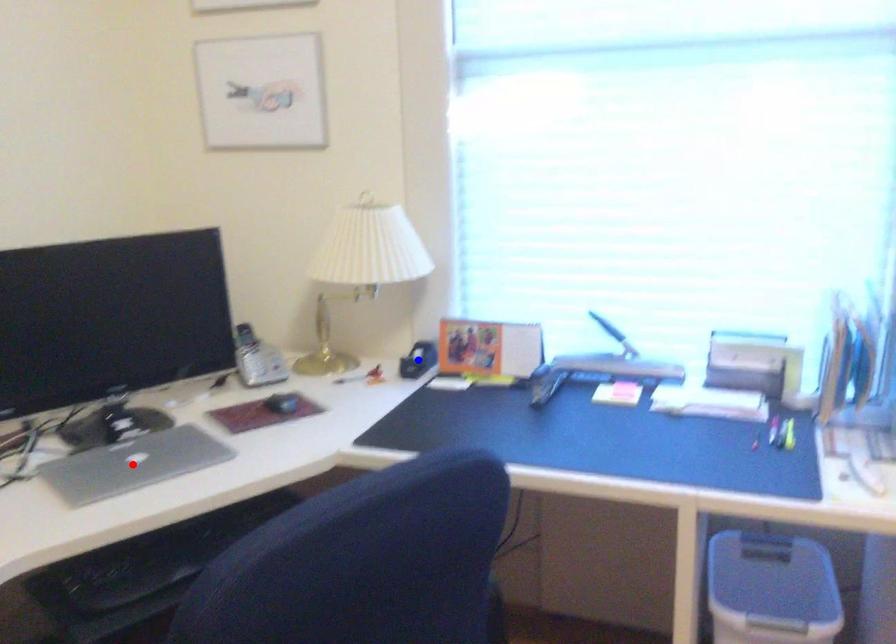
Question: Two points are marked on the image. Which point is closer to the camera?

Choices:
 (A) Blue point is closer.
 (B) Red point is closer.

Answer: (B)